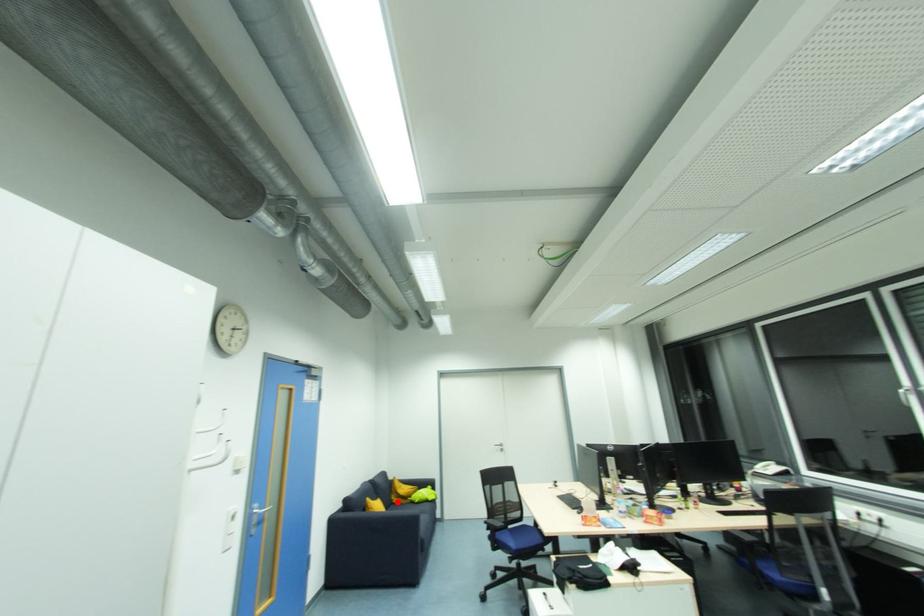
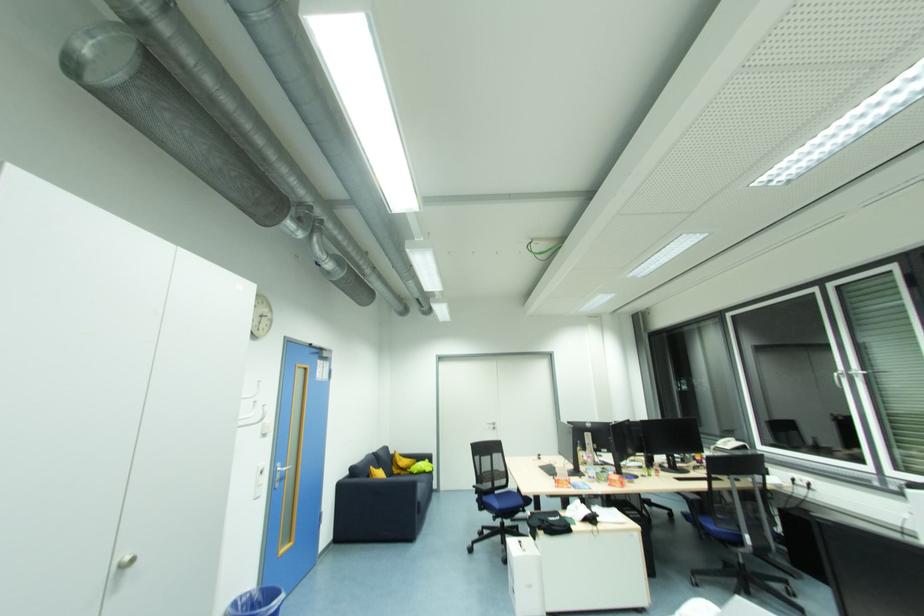
Where in the second image is the point corresponding to the highlighted location from the first image?

(398, 472)